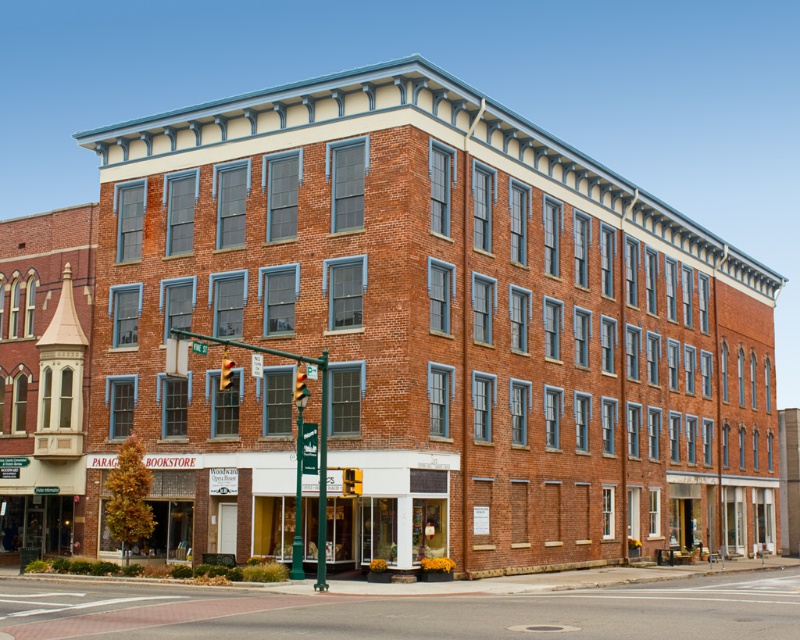
Measure the distance between red glass traffic light at center and yellow plastic traffic light at upper center.

The distance of red glass traffic light at center from yellow plastic traffic light at upper center is 9.04 feet.

Does point (300, 388) come in front of point (228, 372)?

No, it is not.

Find the location of a particular element. The width and height of the screenshot is (800, 640). red glass traffic light at center is located at coordinates (300, 388).

Does smooth asphalt road at lower center have a lesser width compared to yellow plastic traffic light at center?

In fact, smooth asphalt road at lower center might be wider than yellow plastic traffic light at center.

Is point (721, 588) closer to viewer compared to point (360, 490)?

No, (721, 588) is behind (360, 490).

Find the location of a particular element. The height and width of the screenshot is (640, 800). smooth asphalt road at lower center is located at coordinates (408, 611).

Where is `smooth asphalt road at lower center`? The width and height of the screenshot is (800, 640). smooth asphalt road at lower center is located at coordinates (408, 611).

Image resolution: width=800 pixels, height=640 pixels. I want to click on yellow plastic traffic light at center, so click(352, 481).

In the scene shown: Who is lower down, yellow plastic traffic light at center or red glass traffic light at center?

Positioned lower is yellow plastic traffic light at center.

The image size is (800, 640). Describe the element at coordinates (352, 481) in the screenshot. I see `yellow plastic traffic light at center` at that location.

Find the location of a particular element. This screenshot has height=640, width=800. yellow plastic traffic light at center is located at coordinates (352, 481).